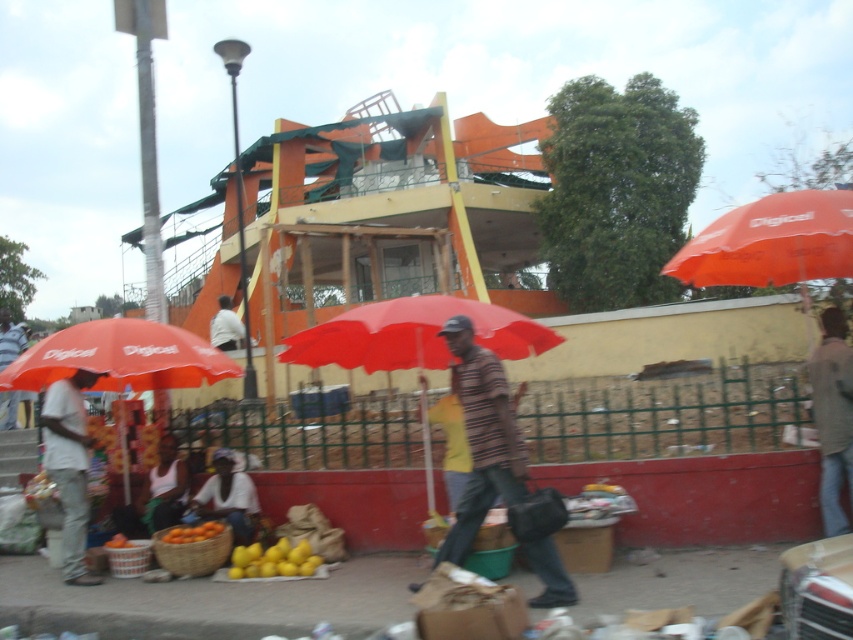
Is orange fabric umbrella at upper right above orange matte at lower left?

Yes, orange fabric umbrella at upper right is above orange matte at lower left.

This screenshot has height=640, width=853. Find the location of `orange fabric umbrella at upper right`. orange fabric umbrella at upper right is located at coordinates (772, 241).

Can you confirm if red matte umbrella at center is taller than orange matte at lower left?

Yes, red matte umbrella at center is taller than orange matte at lower left.

Who is more distant from viewer, (432,358) or (200,536)?

Point (432,358)

You are a GUI agent. You are given a task and a screenshot of the screen. Output one action in this format:
    pyautogui.click(x=<x>, y=<y>)
    Task: Click on the red matte umbrella at center
    This screenshot has width=853, height=640.
    Given the screenshot: What is the action you would take?
    pyautogui.click(x=413, y=333)

Between orange fabric umbrella at upper right and denim jacket at lower right, which one is positioned lower?

denim jacket at lower right

Can you confirm if orange fabric umbrella at upper right is positioned below denim jacket at lower right?

No, orange fabric umbrella at upper right is not below denim jacket at lower right.

Between point (828, 196) and point (822, 525), which one is positioned behind?

Point (822, 525)

The height and width of the screenshot is (640, 853). What are the coordinates of `orange fabric umbrella at upper right` in the screenshot? It's located at (772, 241).